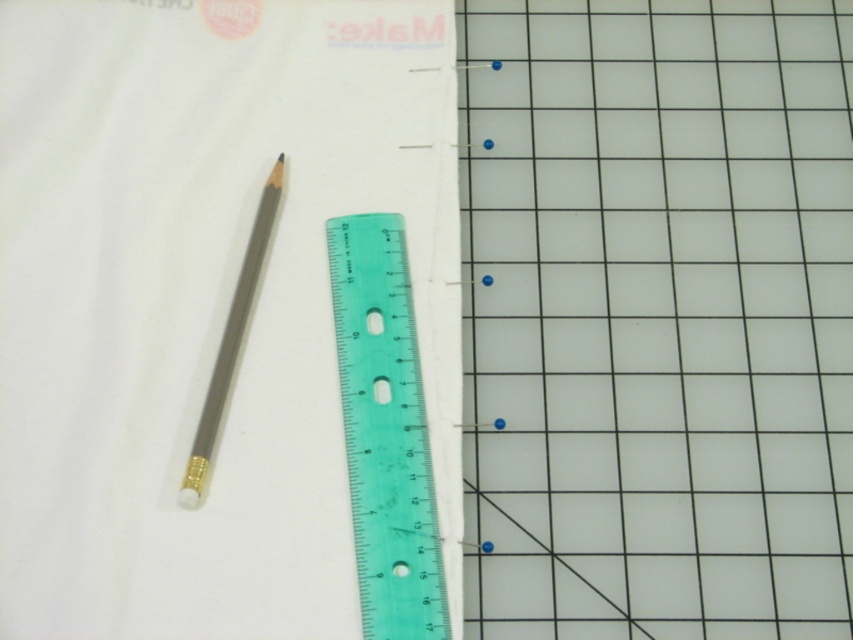
You are organizing your workspace and want to place a new tool between the two points. Given that the workspace is represented by coordinates from 0 to 1 in both x and y axes, can you determine if the point at (531,324) is closer to the center of the workspace than the point at (194,452)?

To determine which point is closer to the center, we calculate the distance from each point to the center coordinates of 0.5, 0.5. For point (531,324), the distance is sqrt of squared differences in x and y from 0.5, which is sqrt of 0.008 squared plus 0.123 squared. For point (194,452), the distance is sqrt of 0.208 squared plus 0.271 squared. The second point has a larger distance, so the first point is closer to the center. Therefore, the point at (531,324) is closer to the center than point 0.7

You are organizing your desk and need to place a small paperweight on the white matte cloth at upper left. However, the matte gold eraser at lower left is blocking the area. Can you place the paperweight there without moving the eraser?

Answer: The white matte cloth at upper left is positioned over the matte gold eraser at lower left, so placing the paperweight on the white matte cloth at upper left would not require moving the matte gold eraser at lower left since it is already under the cloth.